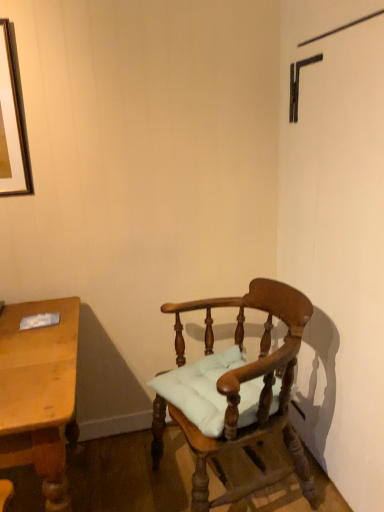
Question: Which is correct: light brown wooden desk at left is inside wooden chair with cushion at center, or outside of it?

Choices:
 (A) outside
 (B) inside

Answer: (A)

Question: In the image, is light brown wooden desk at left positioned in front of or behind wooden chair with cushion at center?

Choices:
 (A) behind
 (B) front

Answer: (B)

Question: From a real-world perspective, relative to wooden chair with cushion at center, is light brown wooden desk at left vertically above or below?

Choices:
 (A) above
 (B) below

Answer: (B)

Question: Does point (266, 408) appear closer or farther from the camera than point (31, 454)?

Choices:
 (A) closer
 (B) farther

Answer: (B)

Question: Is wooden chair with cushion at center situated inside light brown wooden desk at left or outside?

Choices:
 (A) inside
 (B) outside

Answer: (B)

Question: From the image's perspective, is wooden chair with cushion at center located above or below light brown wooden desk at left?

Choices:
 (A) above
 (B) below

Answer: (A)

Question: From a real-world perspective, is wooden chair with cushion at center physically located above or below light brown wooden desk at left?

Choices:
 (A) below
 (B) above

Answer: (B)